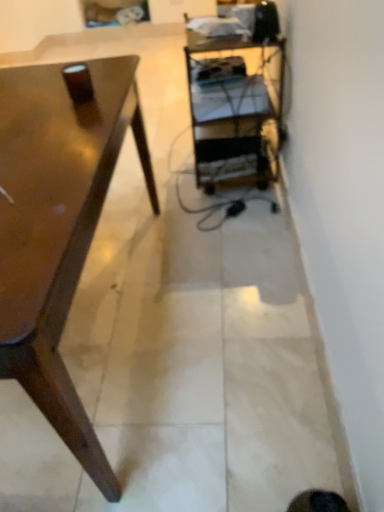
Identify the location of metallic silver shelf at center. This screenshot has width=384, height=512. (235, 115).

This screenshot has width=384, height=512. Describe the element at coordinates (235, 115) in the screenshot. I see `metallic silver shelf at center` at that location.

The image size is (384, 512). Describe the element at coordinates (58, 225) in the screenshot. I see `glossy wood desk at left` at that location.

Identify the location of glossy wood desk at left. (58, 225).

At what (x,y) coordinates should I click in order to perform the action: click on metallic silver shelf at center. Please return your answer as a coordinate pair (x, y). Looking at the image, I should click on (235, 115).

Can you confirm if glossy wood desk at left is positioned to the right of metallic silver shelf at center?

In fact, glossy wood desk at left is to the left of metallic silver shelf at center.

Is glossy wood desk at left positioned before metallic silver shelf at center?

Yes.

Is point (54, 259) farther from viewer compared to point (274, 113)?

No, it is in front of (274, 113).

From the image's perspective, is glossy wood desk at left located above metallic silver shelf at center?

No, from the image's perspective, glossy wood desk at left is not on top of metallic silver shelf at center.

From a real-world perspective, is glossy wood desk at left physically above metallic silver shelf at center?

Yes, from a real-world perspective, glossy wood desk at left is on top of metallic silver shelf at center.

Can you confirm if glossy wood desk at left is wider than metallic silver shelf at center?

Indeed, glossy wood desk at left has a greater width compared to metallic silver shelf at center.

Considering the relative sizes of glossy wood desk at left and metallic silver shelf at center in the image provided, is glossy wood desk at left taller than metallic silver shelf at center?

Incorrect, the height of glossy wood desk at left is not larger of that of metallic silver shelf at center.

Considering the sizes of objects glossy wood desk at left and metallic silver shelf at center in the image provided, who is bigger, glossy wood desk at left or metallic silver shelf at center?

With larger size is glossy wood desk at left.

Would you say glossy wood desk at left is inside or outside metallic silver shelf at center?

The correct answer is: outside.

Is glossy wood desk at left in contact with metallic silver shelf at center?

No, glossy wood desk at left is not beside metallic silver shelf at center.

Could you tell me if glossy wood desk at left is turned towards metallic silver shelf at center?

No, glossy wood desk at left is not oriented towards metallic silver shelf at center.

How many degrees apart are the facing directions of glossy wood desk at left and metallic silver shelf at center?

The angular difference between glossy wood desk at left and metallic silver shelf at center is 90.2 degrees.

Measure the distance from glossy wood desk at left to metallic silver shelf at center.

glossy wood desk at left is 25.99 inches from metallic silver shelf at center.

Find the location of a particular element. The width and height of the screenshot is (384, 512). desk on the left of metallic silver shelf at center is located at coordinates (58, 225).

Which object is positioned more to the right, metallic silver shelf at center or glossy wood desk at left?

metallic silver shelf at center is more to the right.

Which object is closer to the camera taking this photo, metallic silver shelf at center or glossy wood desk at left?

glossy wood desk at left is in front.

Which is closer to the camera, (273, 102) or (94, 478)?

Clearly, point (273, 102) is more distant from the camera than point (94, 478).

From the image's perspective, is metallic silver shelf at center below glossy wood desk at left?

No, from the image's perspective, metallic silver shelf at center is not below glossy wood desk at left.

From a real-world perspective, who is located higher, metallic silver shelf at center or glossy wood desk at left?

In real-world perspective, glossy wood desk at left is above.

Does metallic silver shelf at center have a lesser width compared to glossy wood desk at left?

Correct, the width of metallic silver shelf at center is less than that of glossy wood desk at left.

Looking at this image, is metallic silver shelf at center taller than glossy wood desk at left?

Correct, metallic silver shelf at center is much taller as glossy wood desk at left.

Which of these two, metallic silver shelf at center or glossy wood desk at left, is bigger?

glossy wood desk at left is bigger.

Would you say metallic silver shelf at center is outside glossy wood desk at left?

Yes, metallic silver shelf at center is located beyond the bounds of glossy wood desk at left.

Is metallic silver shelf at center far away from glossy wood desk at left?

No.

Is glossy wood desk at left at the back of metallic silver shelf at center?

No, glossy wood desk at left is not at the back of metallic silver shelf at center.

Image resolution: width=384 pixels, height=512 pixels. I want to click on shelf above the glossy wood desk at left (from the image's perspective), so click(235, 115).

The width and height of the screenshot is (384, 512). Identify the location of shelf behind the glossy wood desk at left. (235, 115).

You are a GUI agent. You are given a task and a screenshot of the screen. Output one action in this format:
    pyautogui.click(x=<x>, y=<y>)
    Task: Click on the desk in front of the metallic silver shelf at center
    
    Given the screenshot: What is the action you would take?
    pyautogui.click(x=58, y=225)